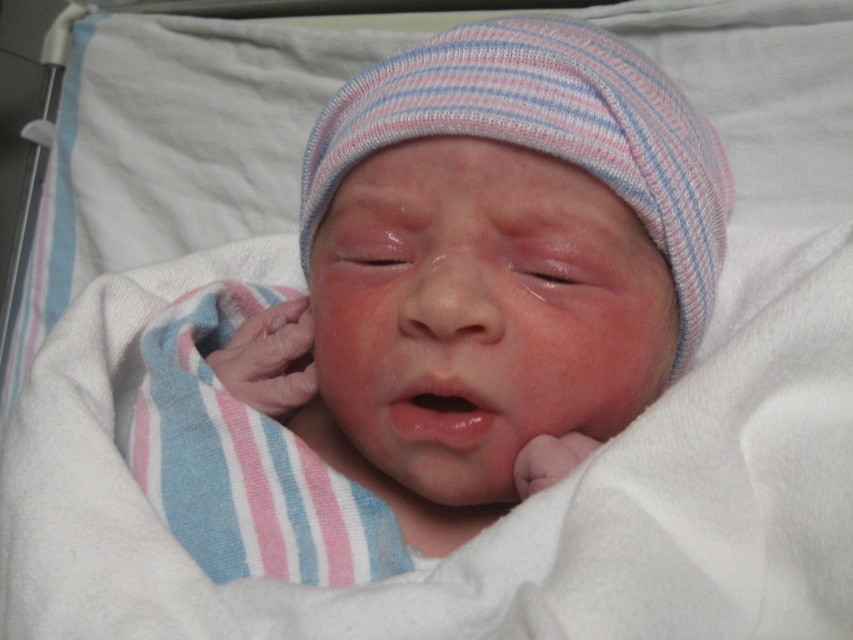
You are a nurse in a hospital nursery. You need to place a pacifier near the striped knit hat at center so the baby can reach it easily. According to the coordinates provided in the Objects Description, where should you place the pacifier relative to the hat?

The striped knit hat at center is located at point (x=544, y=132). To place the pacifier near the hat so the baby can reach it easily, you should position it close to these coordinates, ensuring it is within the baby